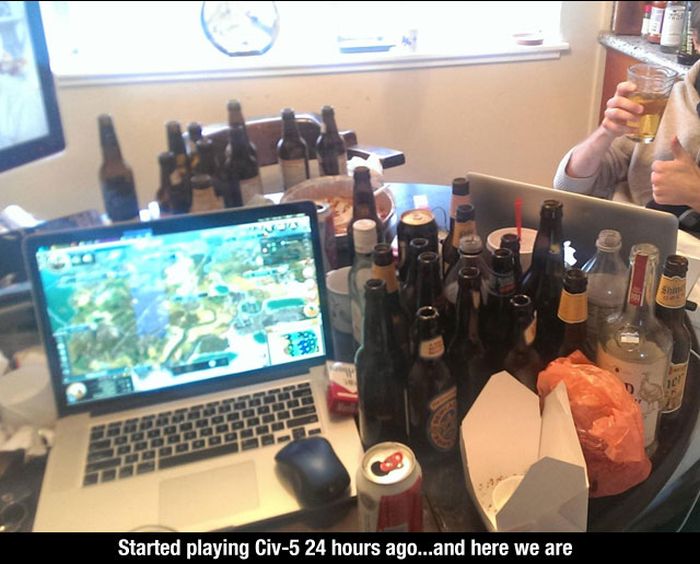
Locate an element on the screen. This screenshot has height=564, width=700. cup is located at coordinates (x=644, y=105).